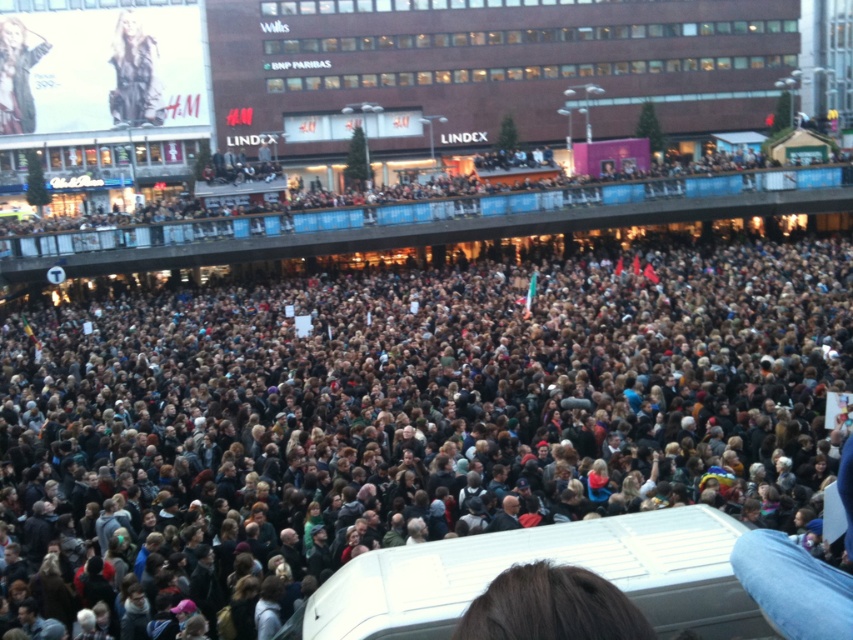
Question: Can you confirm if metallic silver figure at upper left is positioned to the left of matte black jacket at upper left?

Choices:
 (A) no
 (B) yes

Answer: (A)

Question: Which of the following is the farthest from the observer?

Choices:
 (A) metallic silver figure at upper left
 (B) dark brown hair at center
 (C) matte black jacket at upper left

Answer: (A)

Question: Can you confirm if dark brown hair at center is thinner than metallic silver figure at upper left?

Choices:
 (A) no
 (B) yes

Answer: (A)

Question: Does metallic silver figure at upper left lie in front of matte black jacket at upper left?

Choices:
 (A) no
 (B) yes

Answer: (A)

Question: Which point appears farthest from the camera in this image?

Choices:
 (A) (123, 108)
 (B) (200, 362)

Answer: (A)

Question: Which object is positioned closest to the metallic silver figure at upper left?

Choices:
 (A) dark brown hair at center
 (B) matte black jacket at upper left

Answer: (B)